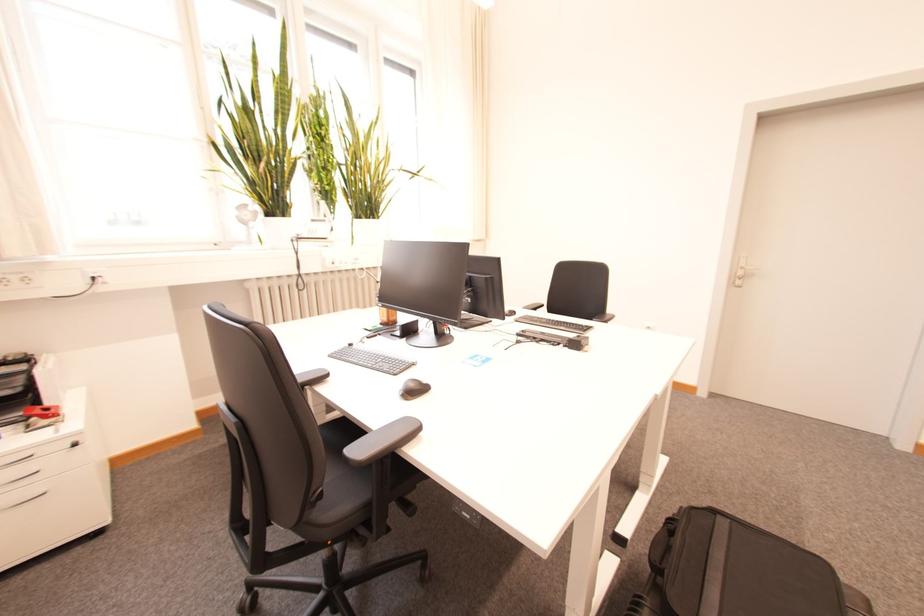
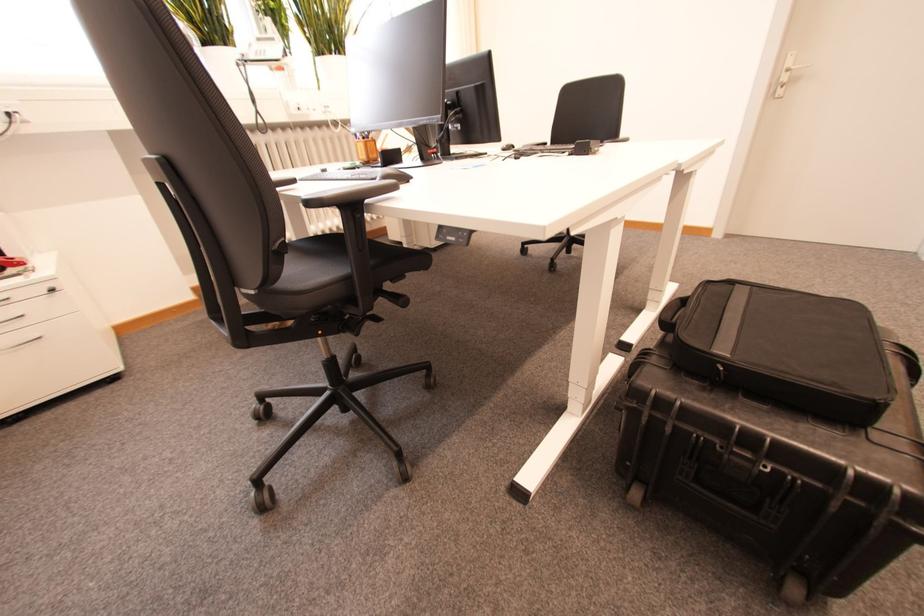
Where in the second image is the point corresponding to point (748, 265) from the first image?

(796, 65)